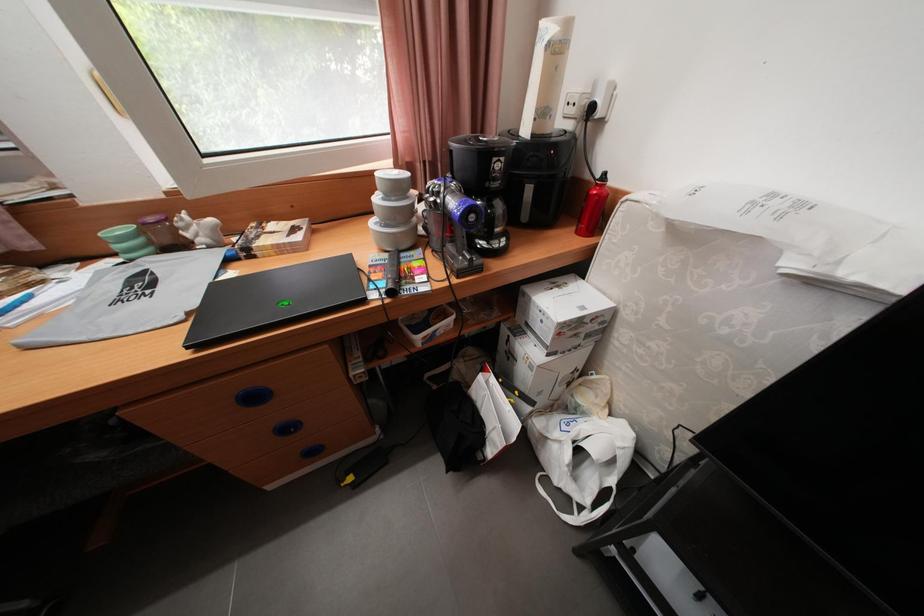
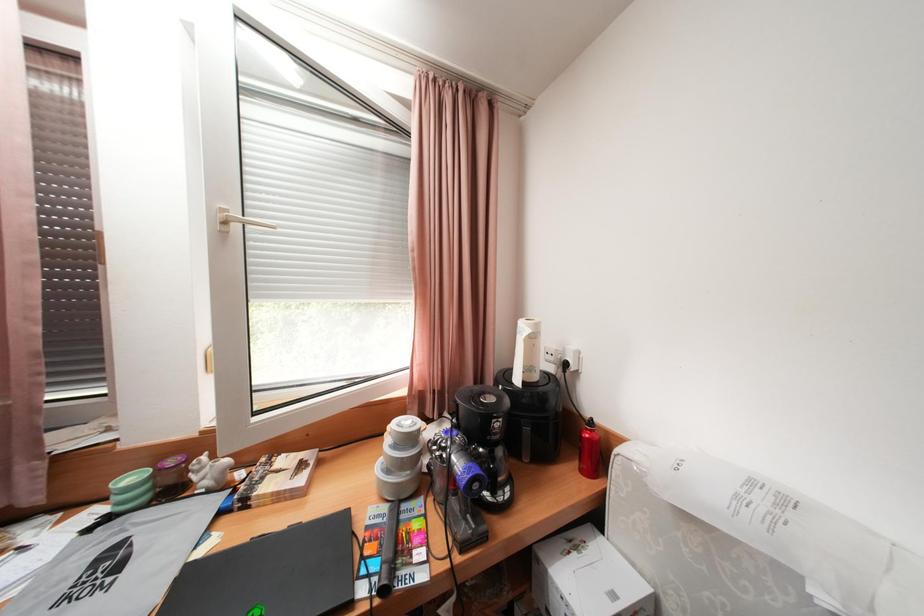
Question: How did the camera likely rotate?

Choices:
 (A) Left
 (B) Right
 (C) Up
 (D) Down

Answer: (C)